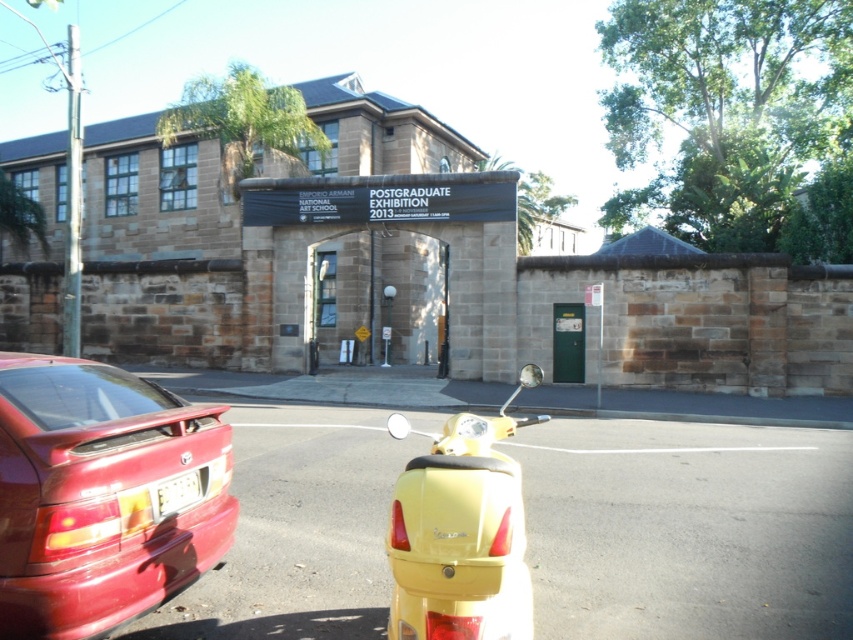
You are a delivery person needing to park your vehicle between the glossy red car at lower left and the yellow matte scooter at center. Which vehicle should you park closer to if you want to maximize space for future vehicles?

You should park closer to the yellow matte scooter at center because the glossy red car at lower left is wider than the yellow matte scooter at center, leaving more space near the scooter for additional vehicles.

You are standing at the point with coordinates (100, 496). Can you see the yellow scooter in the foreground from this position? Please explain your reasoning.

The point at (100, 496) is located on the glossy red car at lower left. Since the yellow scooter is in the foreground, it is closer to the viewer than the car. Therefore, the yellow scooter would likely block the view of the point on the red car, meaning you might not see the point clearly. However, the question asks if you can see the yellow scooter from the point. Since the scooter is in the foreground and the point is on the car which is further back, the scooter would be between the viewer and the car